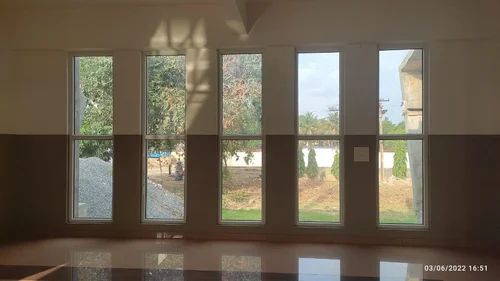
I want to click on floor, so click(221, 258).